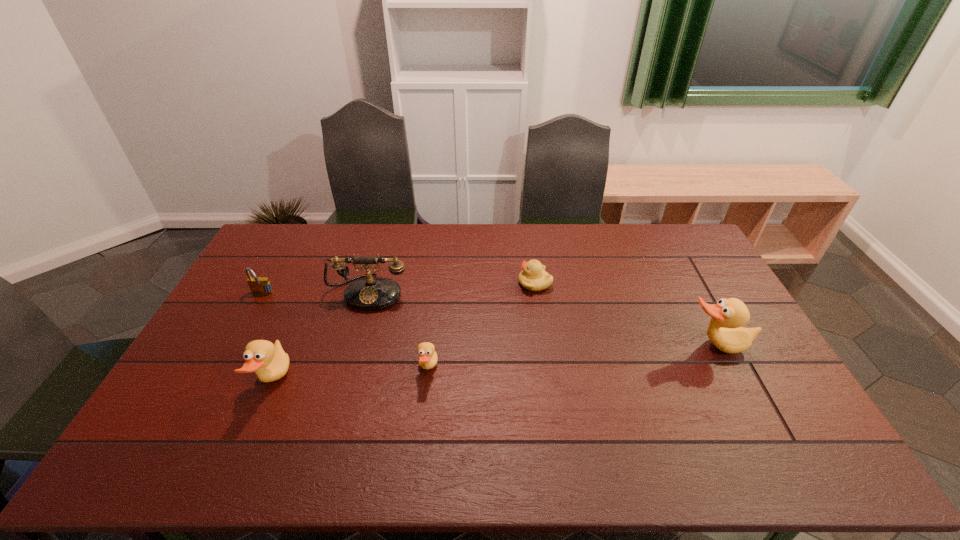
This screenshot has height=540, width=960. I want to click on the second shortest duck, so click(x=269, y=361).

Identify the location of the second object from left to right. The image size is (960, 540). (269, 361).

You are a GUI agent. You are given a task and a screenshot of the screen. Output one action in this format:
    pyautogui.click(x=<x>, y=<y>)
    Task: Click on the third object from right to left
    The height and width of the screenshot is (540, 960).
    Given the screenshot: What is the action you would take?
    pyautogui.click(x=427, y=355)

At what (x,y) coordinates should I click in order to perform the action: click on the shortest duck. Please return your answer as a coordinate pair (x, y). The width and height of the screenshot is (960, 540). Looking at the image, I should click on [x=427, y=355].

You are a GUI agent. You are given a task and a screenshot of the screen. Output one action in this format:
    pyautogui.click(x=<x>, y=<y>)
    Task: Click on the rightmost duck
    
    Given the screenshot: What is the action you would take?
    pyautogui.click(x=725, y=331)

This screenshot has width=960, height=540. What are the coordinates of `the leftmost object` in the screenshot? It's located at (259, 285).

Find the location of a particular element. This screenshot has height=540, width=960. duckling is located at coordinates (533, 277).

Locate an element on the screen. telephone is located at coordinates (371, 293).

Locate an element on the screen. vacant space located 0.340m on the beak of the leftmost duck is located at coordinates (411, 381).

Where is `free location located on the beak of the fourth object from left to right`? Image resolution: width=960 pixels, height=540 pixels. free location located on the beak of the fourth object from left to right is located at coordinates (508, 369).